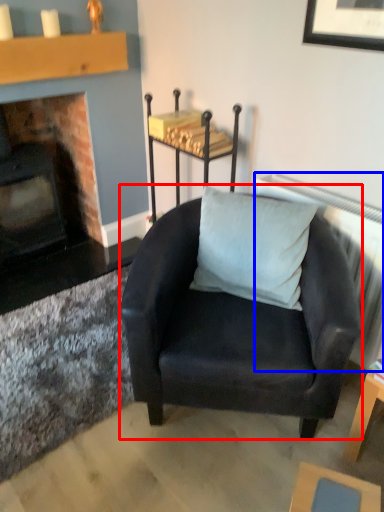
Question: Which object appears farthest to the camera in this image, chair (highlighted by a red box) or radiator (highlighted by a blue box)?

Choices:
 (A) chair
 (B) radiator

Answer: (B)